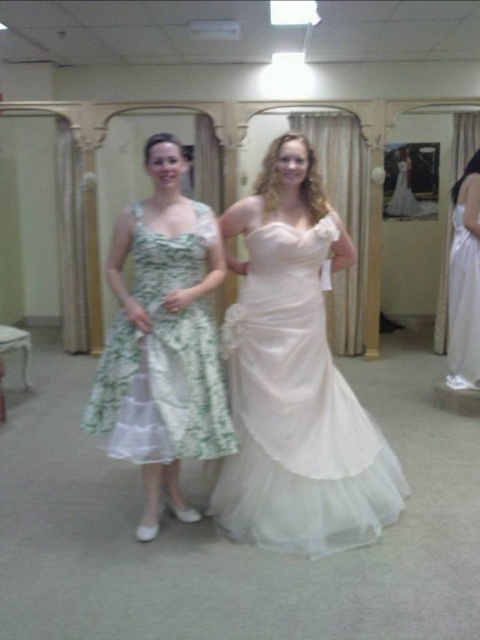
You are a customer in a bridal shop trying to decide between two dresses. You see the satin white dress at center and the green floral fabric dress at center. Which dress is positioned to the right of the other?

The satin white dress at center is to the right of the green floral fabric dress at center.

You are a photographer in a bridal shop. You need to position two dresses in the center of the room for a photo shoot. The dresses are the satin white dress at center and the green floral fabric dress at center. Given their sizes, which dress should you place closer to the camera to ensure both are visible in the frame?

The satin white dress at center is much taller than the green floral fabric dress at center, so you should place the green floral fabric dress at center closer to the camera to ensure both are visible in the frame.

You are a customer in a bridal shop and want to try on the green floral fabric dress at center and the white satin dress at right. However, there is only one full length mirror available. Which dress should you try on first to ensure you can see your full body in the mirror while wearing it?

You should try on the white satin dress at right first because the green floral fabric dress at center is positioned under it, meaning the white satin dress is taller and would require more vertical space in the mirror to view the entire length.